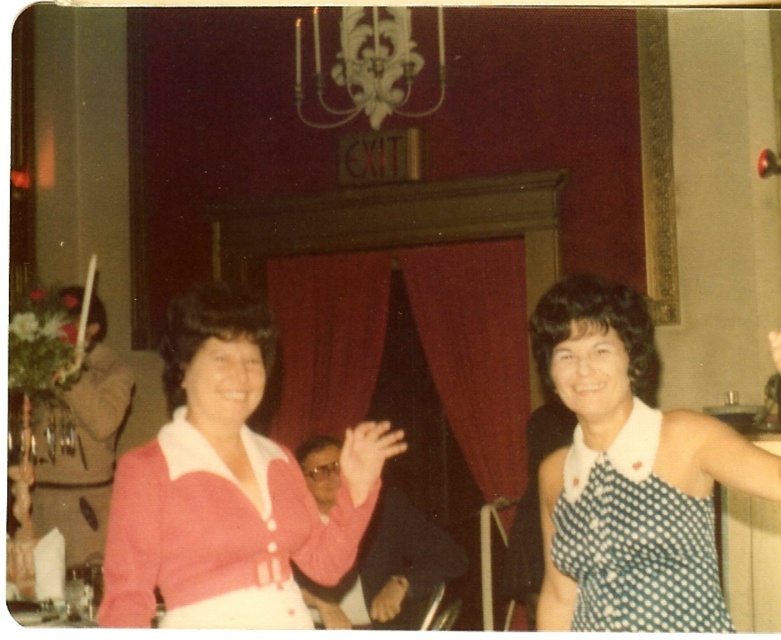
Question: Is pink matte cardigan at center wider than brown leather handbag at lower center?

Choices:
 (A) no
 (B) yes

Answer: (B)

Question: Can you confirm if white polka dot dress at right is bigger than matte pink sweater at center?

Choices:
 (A) no
 (B) yes

Answer: (B)

Question: Which object is the closest to the matte pink sweater at center?

Choices:
 (A) brown leather handbag at lower center
 (B) pink matte cardigan at center

Answer: (B)

Question: Which object is closer to the camera taking this photo?

Choices:
 (A) pink matte cardigan at center
 (B) white polka dot dress at right

Answer: (A)

Question: Which object appears closest to the camera in this image?

Choices:
 (A) white polka dot dress at center
 (B) pink matte cardigan at center
 (C) brown leather handbag at lower center
 (D) matte pink sweater at center

Answer: (A)

Question: Where is pink matte cardigan at center located in relation to white polka dot dress at right in the image?

Choices:
 (A) right
 (B) left

Answer: (B)